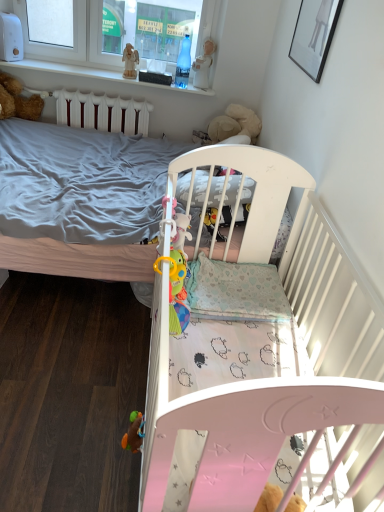
Question: Considering their positions, is white glossy picture frame at upper right located in front of or behind multicolored plastic toy at lower left, marked as the 1th toy in a left-to-right arrangement?

Choices:
 (A) behind
 (B) front

Answer: (A)

Question: From a real-world perspective, is white glossy picture frame at upper right physically located above or below multicolored plastic toy at lower left, the first toy positioned from the front?

Choices:
 (A) above
 (B) below

Answer: (A)

Question: Considering the real-world distances, which object is closest to the white wooden balustrade at upper center?

Choices:
 (A) multicolored plastic toy at lower left, positioned as the 2th toy in right-to-left order
 (B) wooden angel at upper center
 (C) white plastic statue at upper center, which is the 1th toy from back to front
 (D) white plastic window frame at upper left
 (E) white glossy picture frame at upper right

Answer: (D)

Question: Which of these objects is positioned closest to the white glossy picture frame at upper right?

Choices:
 (A) white wooden balustrade at upper center
 (B) multicolored plastic toy at lower left, positioned as the 2th toy in back-to-front order
 (C) wooden angel at upper center
 (D) white plastic window frame at upper left
 (E) white plastic statue at upper center, the first toy when ordered from right to left

Answer: (E)